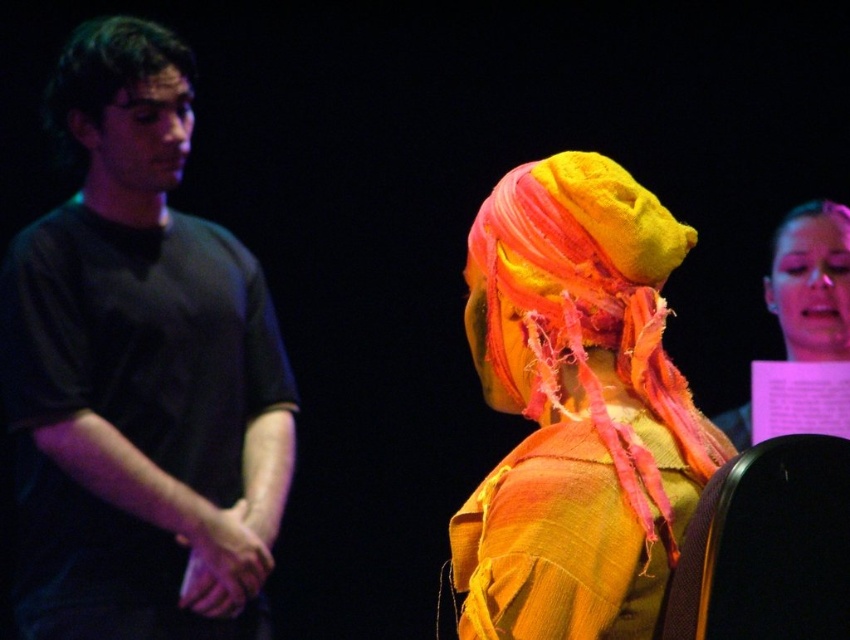
You are a costume designer observing the scene. You need to determine which item is higher in position between the black matte shirt at left and the matte yellow fabric headscarf at upper right. Based on the spatial arrangement, which one is positioned higher?

The black matte shirt at left is taller than the matte yellow fabric headscarf at upper right, so the black matte shirt at left is positioned higher.